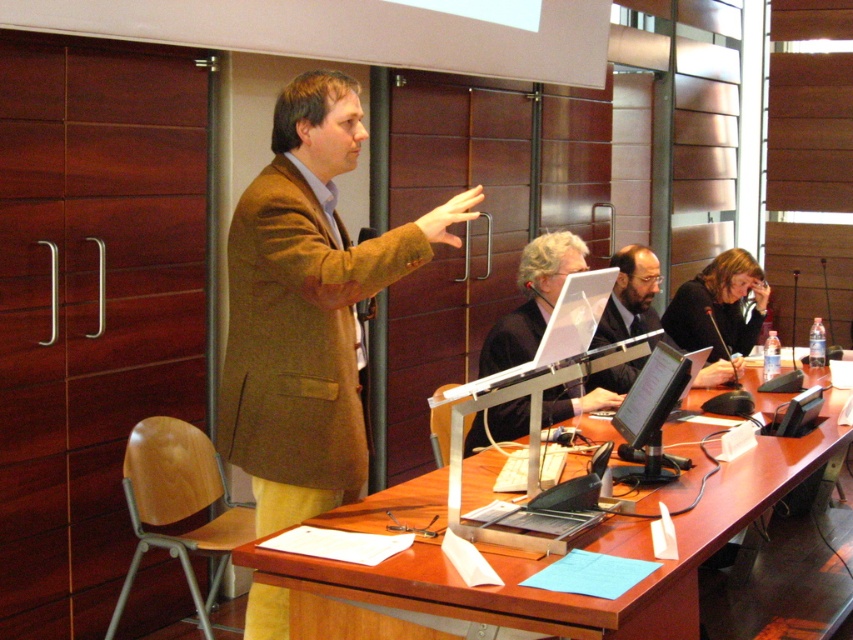
Between brown woolen blazer at center and matte black laptop at center, which one has less height?

With less height is matte black laptop at center.

You are a GUI agent. You are given a task and a screenshot of the screen. Output one action in this format:
    pyautogui.click(x=<x>, y=<y>)
    Task: Click on the brown woolen blazer at center
    Image resolution: width=853 pixels, height=640 pixels.
    Given the screenshot: What is the action you would take?
    pyautogui.click(x=306, y=307)

In the scene shown: Does matte black laptop at center have a lesser width compared to matte black suit at center?

In fact, matte black laptop at center might be wider than matte black suit at center.

Who is more forward, (683, 324) or (635, 328)?

Point (635, 328) is in front.

Measure the distance between point [705,289] and camera.

Point [705,289] is 4.64 meters from camera.

Image resolution: width=853 pixels, height=640 pixels. In order to click on matte black laptop at center in this screenshot , I will do `click(718, 305)`.

Which is in front, point (563, 600) or point (677, 333)?

Positioned in front is point (563, 600).

Is point (691, 573) behind point (738, 291)?

That is False.

Between point (299, 621) and point (759, 317), which one is positioned behind?

Point (759, 317)

Locate an element on the screen. This screenshot has height=640, width=853. brown wooden table at center is located at coordinates (547, 563).